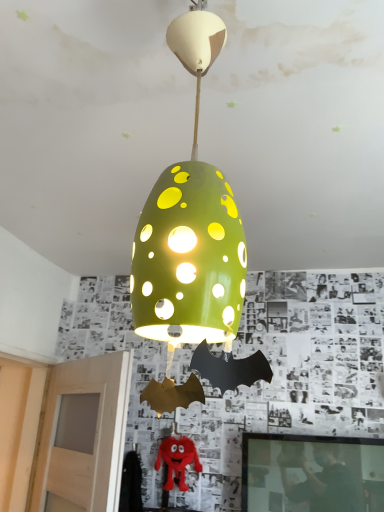
The image size is (384, 512). What do you see at coordinates (194, 240) in the screenshot?
I see `green matte/porcelain lampshade at center` at bounding box center [194, 240].

Locate an element on the screen. The height and width of the screenshot is (512, 384). green matte/porcelain lampshade at center is located at coordinates (194, 240).

Locate an element on the screen. This screenshot has height=512, width=384. green matte/porcelain lampshade at center is located at coordinates (194, 240).